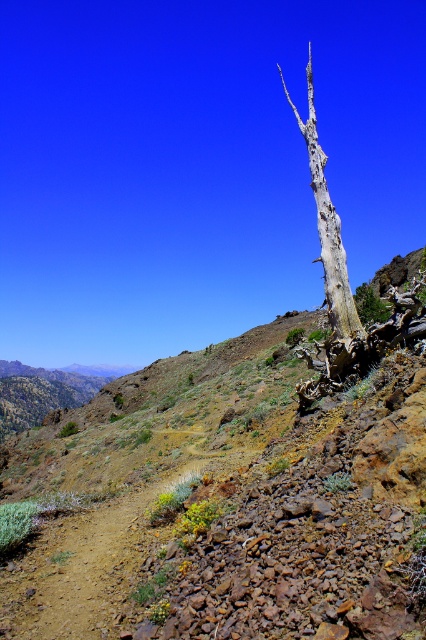
Question: Among these objects, which one is nearest to the camera?

Choices:
 (A) dead wood at upper right
 (B) grayish-brown bark tree trunk at right

Answer: (B)

Question: Does grayish-brown bark tree trunk at right appear under dead wood at upper right?

Choices:
 (A) yes
 (B) no

Answer: (B)

Question: Is grayish-brown bark tree trunk at right further to camera compared to dead wood at upper right?

Choices:
 (A) no
 (B) yes

Answer: (A)

Question: Does grayish-brown bark tree trunk at right have a greater width compared to dead wood at upper right?

Choices:
 (A) no
 (B) yes

Answer: (B)